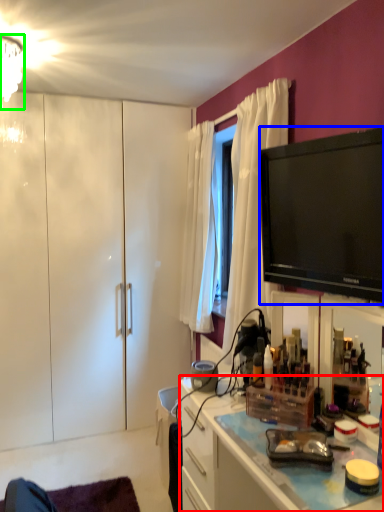
Question: Estimate the real-world distances between objects in this image. Which object is closer to cabinetry (highlighted by a red box), television (highlighted by a blue box) or lamp (highlighted by a green box)?

Choices:
 (A) television
 (B) lamp

Answer: (A)